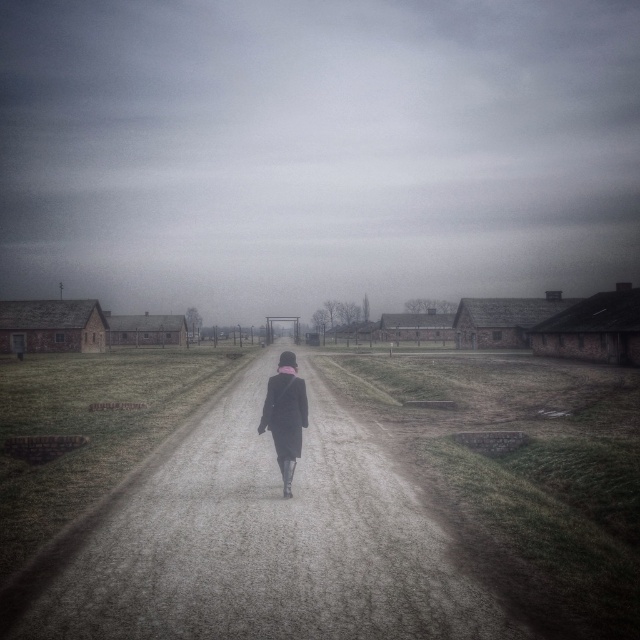
Looking at this image, you are a visitor at the memorial site. You see the gray fog at center and the dirt road at center. Which one appears taller from your perspective?

The gray fog at center appears taller than the dirt road at center because it is much taller as described.